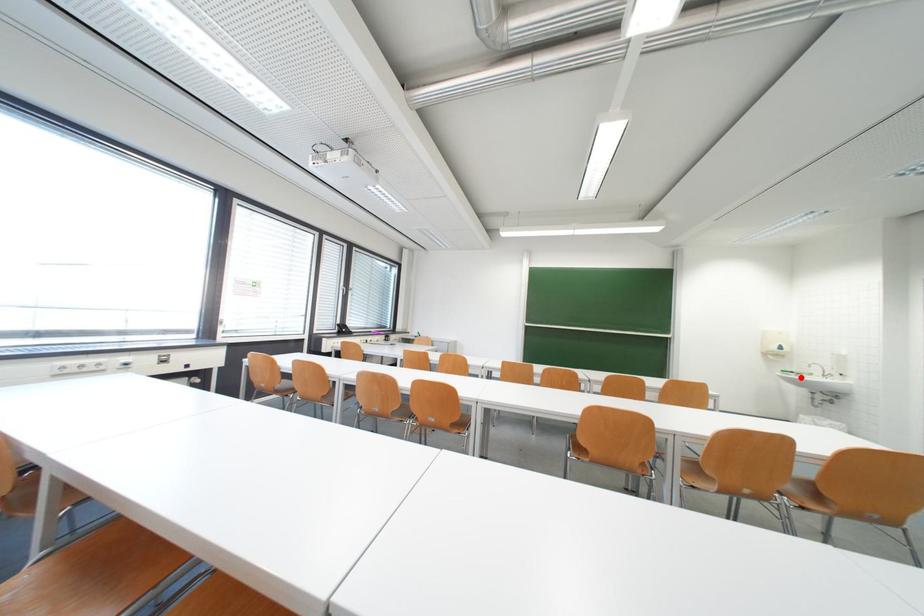
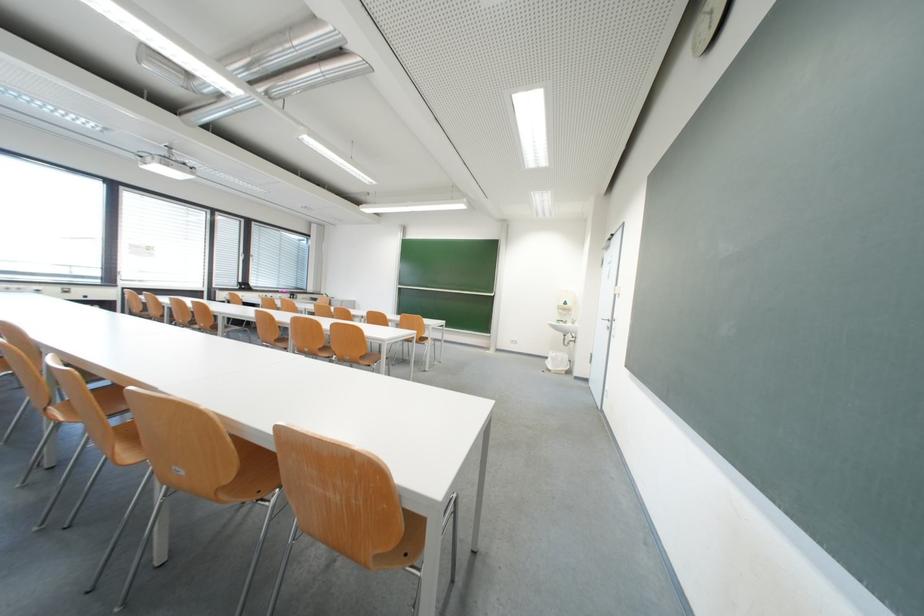
Question: I am providing you with two images of the same scene from different viewpoints. A red point is marked on the first image. Can you still see the location of the red point in image 2?

Choices:
 (A) Yes
 (B) No

Answer: (A)